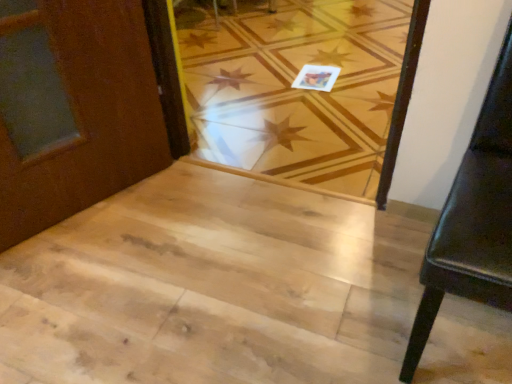
Identify the location of vacant space to the left of black leather chair at right. (314, 293).